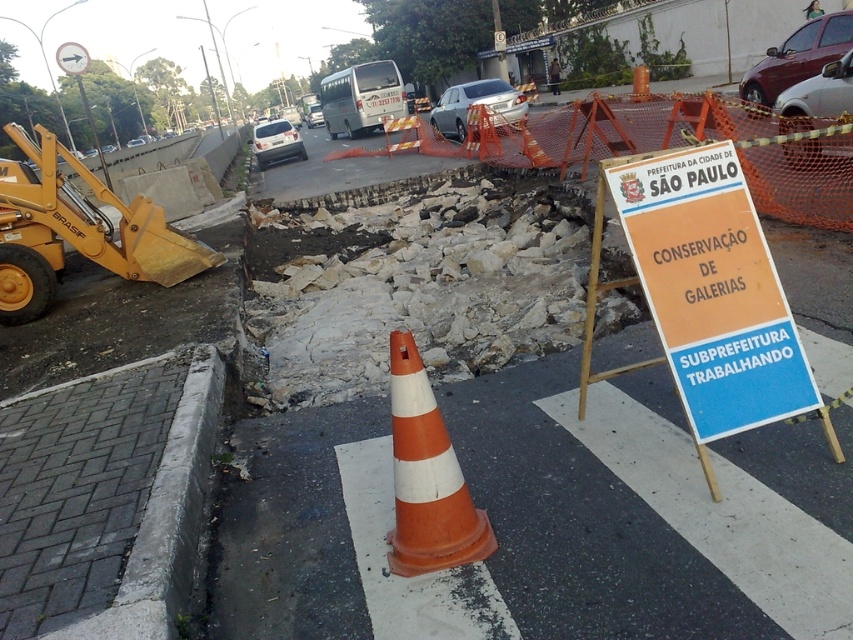
Question: In this image, where is orange cardboard sign at center right located relative to orange/white striped traffic cone at center?

Choices:
 (A) above
 (B) below

Answer: (A)

Question: Which object is farther from the camera taking this photo?

Choices:
 (A) orange/white striped traffic cone at center
 (B) orange cardboard sign at center right

Answer: (B)

Question: Is the position of orange cardboard sign at center right less distant than that of yellow metallic excavator at left?

Choices:
 (A) yes
 (B) no

Answer: (A)

Question: Which of the following is the farthest from the observer?

Choices:
 (A) orange/white striped traffic cone at center
 (B) orange cardboard sign at center right

Answer: (B)

Question: Which of the following is the farthest from the observer?

Choices:
 (A) (85, 170)
 (B) (695, 236)

Answer: (A)

Question: Can you confirm if orange cardboard sign at center right is smaller than yellow metallic excavator at left?

Choices:
 (A) no
 (B) yes

Answer: (A)